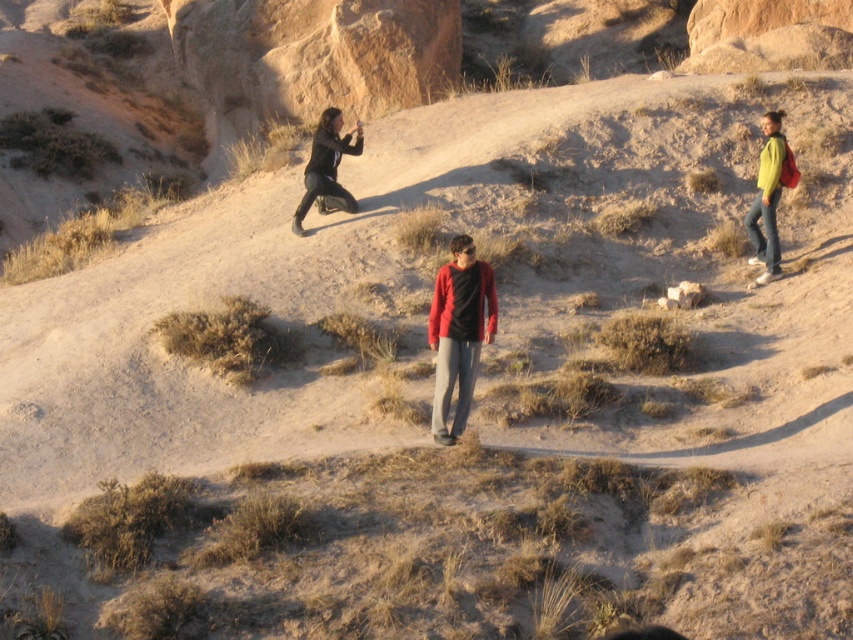
Question: Which point appears farthest from the camera in this image?

Choices:
 (A) (329, 116)
 (B) (450, 397)
 (C) (764, 253)

Answer: (A)

Question: Which of the following is the closest to the observer?

Choices:
 (A) matte black jacket at upper center
 (B) matte red sweater at center

Answer: (B)

Question: Which of the following is the farthest from the observer?

Choices:
 (A) (756, 198)
 (B) (335, 200)
 (C) (461, 364)

Answer: (B)

Question: Is matte black jacket at upper center below green matte jacket at right?

Choices:
 (A) yes
 (B) no

Answer: (B)

Question: Does matte red sweater at center have a greater width compared to green matte jacket at right?

Choices:
 (A) yes
 (B) no

Answer: (A)

Question: Is matte red sweater at center thinner than green matte jacket at right?

Choices:
 (A) yes
 (B) no

Answer: (B)